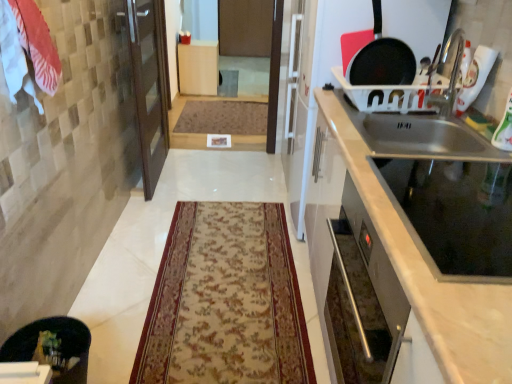
Identify the location of free spot below beige floral rug at center, arranged as the 1th mat when ordered from the bottom (from a real-world perspective). The height and width of the screenshot is (384, 512). (215, 299).